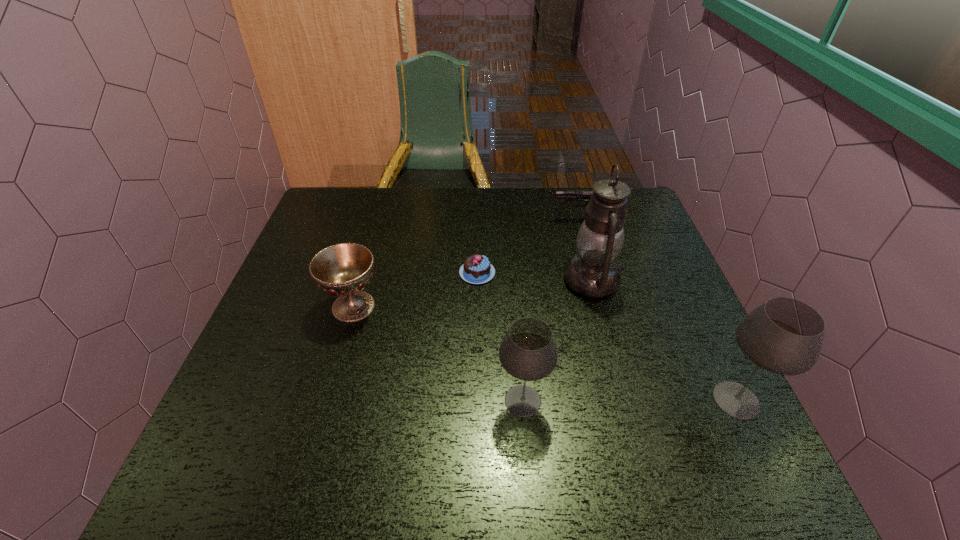
Where is `vacant place for an extra wineglass on the left`? Image resolution: width=960 pixels, height=540 pixels. vacant place for an extra wineglass on the left is located at coordinates (309, 402).